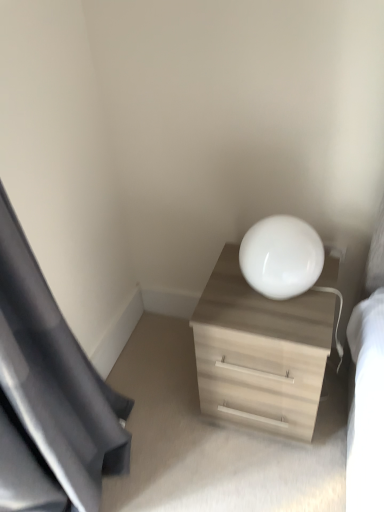
In order to face black fabric curtain at left, should I rotate leftwards or rightwards?

You should rotate left by 20.917 degrees.

The image size is (384, 512). Find the location of `light wood dresser at center`. light wood dresser at center is located at coordinates (260, 352).

Considering the positions of point (258, 222) and point (46, 289), is point (258, 222) closer or farther from the camera than point (46, 289)?

Point (258, 222) appears to be farther away from the viewer than point (46, 289).

Considering the relative sizes of white glossy lampshade at upper right and black fabric curtain at left in the image provided, is white glossy lampshade at upper right smaller than black fabric curtain at left?

Yes, white glossy lampshade at upper right is smaller than black fabric curtain at left.

Does white glossy lampshade at upper right turn towards black fabric curtain at left?

No, white glossy lampshade at upper right is not facing towards black fabric curtain at left.

Is the depth of white glossy lampshade at upper right greater than that of black fabric curtain at left?

That is True.

From a real-world perspective, is black fabric curtain at left beneath white glossy lampshade at upper right?

No.

Which object is positioned more to the left, black fabric curtain at left or white glossy lampshade at upper right?

black fabric curtain at left is more to the left.

Which object is closer to the camera taking this photo, black fabric curtain at left or white glossy lampshade at upper right?

black fabric curtain at left is more forward.

Is point (50, 310) farther from camera compared to point (269, 222)?

No, it is in front of (269, 222).

Is black fabric curtain at left completely or partially inside light wood dresser at center?

No, black fabric curtain at left is not inside light wood dresser at center.

Is light wood dresser at center not near black fabric curtain at left?

They are positioned close to each other.

Who is bigger, light wood dresser at center or black fabric curtain at left?

black fabric curtain at left.

Is black fabric curtain at left shorter than light wood dresser at center?

No.

Find the location of `dresser that is on the right side of black fabric curtain at left`. dresser that is on the right side of black fabric curtain at left is located at coordinates (260, 352).

Considering the sizes of objects black fabric curtain at left and light wood dresser at center in the image provided, who is thinner, black fabric curtain at left or light wood dresser at center?

Thinner between the two is black fabric curtain at left.

Does white glossy lampshade at upper right have a lesser height compared to light wood dresser at center?

Indeed, white glossy lampshade at upper right has a lesser height compared to light wood dresser at center.

Is the position of white glossy lampshade at upper right more distant than that of light wood dresser at center?

No, it is in front of light wood dresser at center.

Does light wood dresser at center appear on the right side of white glossy lampshade at upper right?

Correct, you'll find light wood dresser at center to the right of white glossy lampshade at upper right.

The height and width of the screenshot is (512, 384). In the image, there is a white glossy lampshade at upper right. Identify the location of dresser below it (from a real-world perspective). (260, 352).

Which is more distant, (231,411) or (308,273)?

The point (231,411) is behind.

Is light wood dresser at center oriented towards white glossy lampshade at upper right?

No, light wood dresser at center does not turn towards white glossy lampshade at upper right.

The image size is (384, 512). What are the coordinates of `round table directly beneath the black fabric curtain at left (from a real-world perspective)` in the screenshot? It's located at (281, 257).

In order to click on curtain located above the white glossy lampshade at upper right (from a real-world perspective) in this screenshot , I will do `click(55, 377)`.

Based on their spatial positions, is light wood dresser at center or black fabric curtain at left closer to white glossy lampshade at upper right?

light wood dresser at center is positioned closer to the anchor white glossy lampshade at upper right.

Which object lies further to the anchor point light wood dresser at center, black fabric curtain at left or white glossy lampshade at upper right?

black fabric curtain at left.

From the image, which object appears to be farther from white glossy lampshade at upper right, black fabric curtain at left or light wood dresser at center?

black fabric curtain at left.

Based on their spatial positions, is light wood dresser at center or white glossy lampshade at upper right closer to black fabric curtain at left?

The object closer to black fabric curtain at left is light wood dresser at center.

From the image, which object appears to be farther from black fabric curtain at left, white glossy lampshade at upper right or light wood dresser at center?

The object further to black fabric curtain at left is white glossy lampshade at upper right.

Estimate the real-world distances between objects in this image. Which object is closer to light wood dresser at center, white glossy lampshade at upper right or black fabric curtain at left?

white glossy lampshade at upper right is positioned closer to the anchor light wood dresser at center.

The height and width of the screenshot is (512, 384). I want to click on round table between black fabric curtain at left and light wood dresser at center from front to back, so click(281, 257).